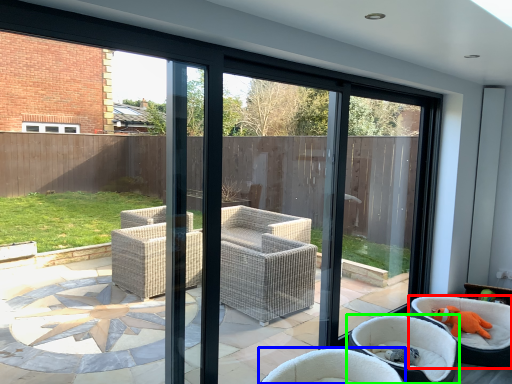
Question: Based on their relative distances, which object is nearer to chair (highlighted by a red box)? Choose from chair (highlighted by a blue box) and chair (highlighted by a green box).

Choices:
 (A) chair
 (B) chair

Answer: (B)